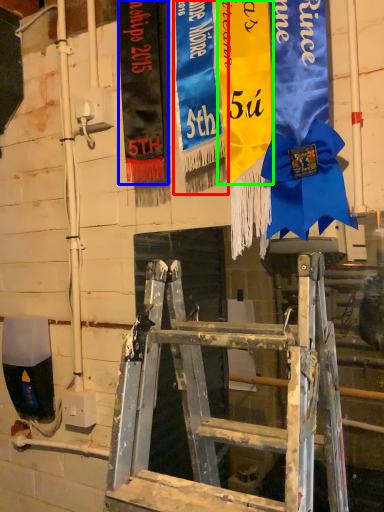
Question: Estimate the real-world distances between objects in this image. Which object is closer to tapestry (highlighted by a red box), tapestry (highlighted by a blue box) or tapestry (highlighted by a green box)?

Choices:
 (A) tapestry
 (B) tapestry

Answer: (B)